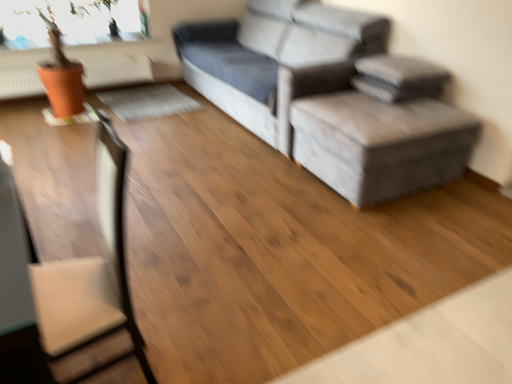
Image resolution: width=512 pixels, height=384 pixels. Identify the location of free space that is in between gray fabric couch at upper right and brown leather swivel chair at left. (210, 201).